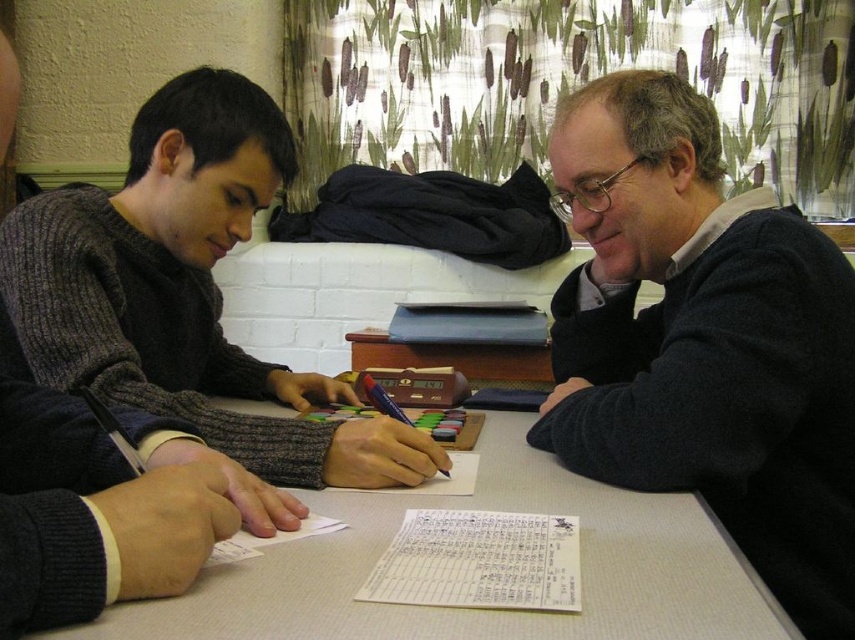
You are a delivery robot with a height of 1.2 meters. You need to place a small package on the table where the two people are playing a game. The package will be placed at point (x=231, y=150). Will the package be visible to the people at the table?

The distance of point (x=231, y=150) from the camera is 1.16 meters. Since the robot is 1.2 meters tall, the package placed at this point will be just barely visible to the people at the table, as the robot is slightly taller than the distance from the camera to the point.

You are a delivery person who needs to place a small package on the table. The package is 12 inches long. Can you fit it between the dark blue sweater at right and the white textured table at center without moving either?

The distance between the dark blue sweater at right and the white textured table at center is 10.37 inches, which is shorter than the package length of 12 inches. Therefore, the package cannot be placed there without moving either object.